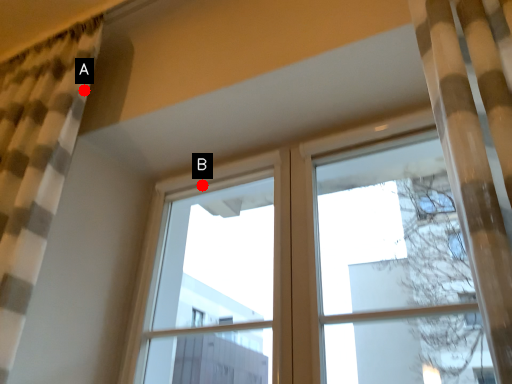
Question: Two points are circled on the image, labeled by A and B beside each circle. Which point appears farthest from the camera in this image?

Choices:
 (A) A is further
 (B) B is further

Answer: (B)